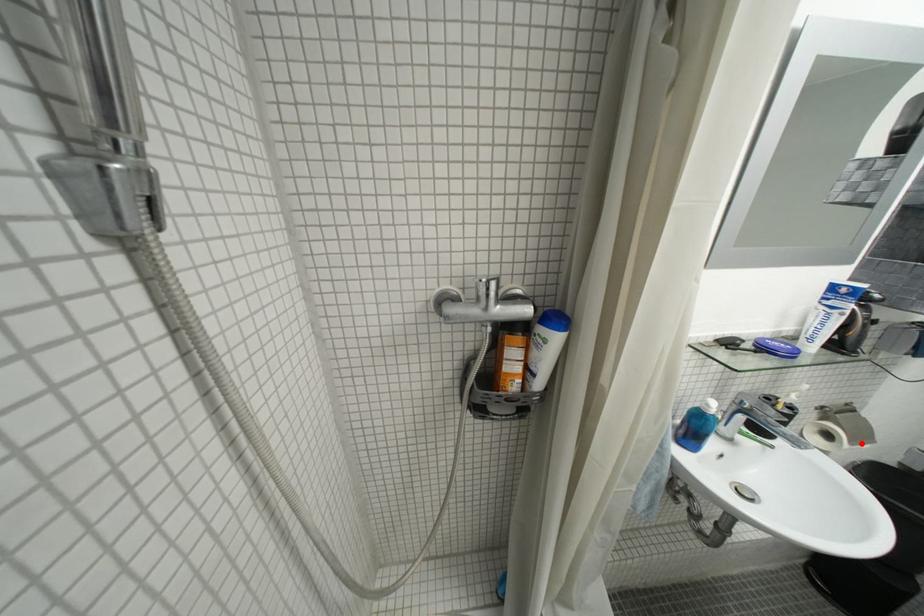
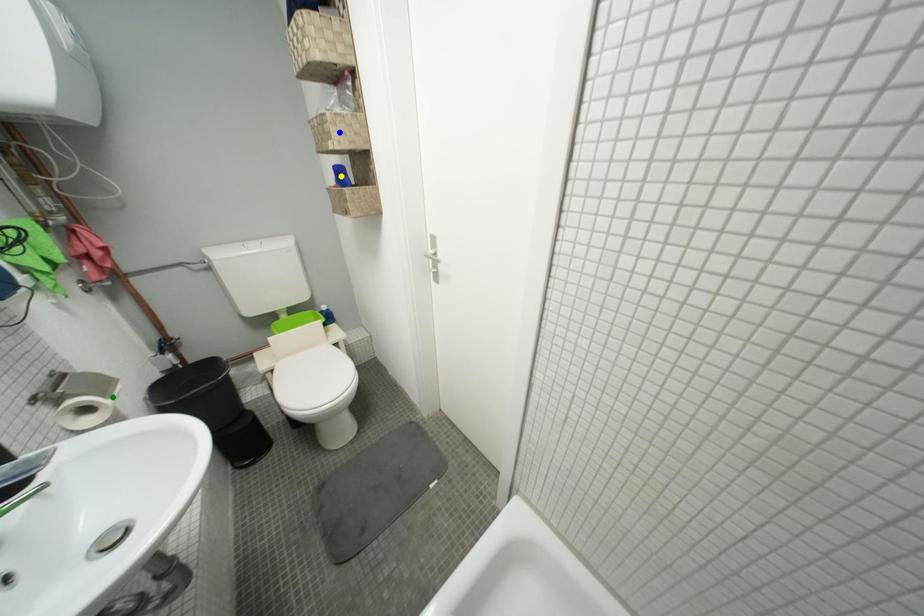
Question: I am providing you with two images of the same scene from different viewpoints. A red point is marked on the first image. You are given multiple points on the second image. Which mark in image 2 goes with the point in image 1?

Choices:
 (A) green point
 (B) blue point
 (C) yellow point

Answer: (A)